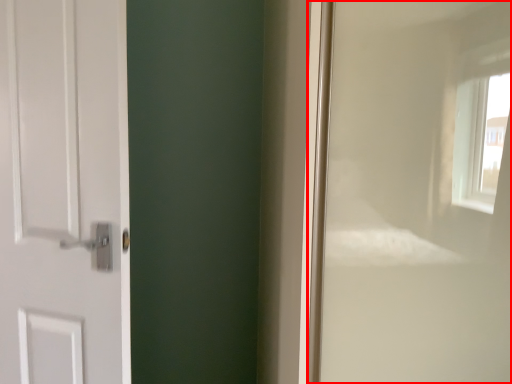
Question: Considering the relative positions of window frame (annotated by the red box) and door in the image provided, where is window frame (annotated by the red box) located with respect to the staircase?

Choices:
 (A) left
 (B) right

Answer: (B)